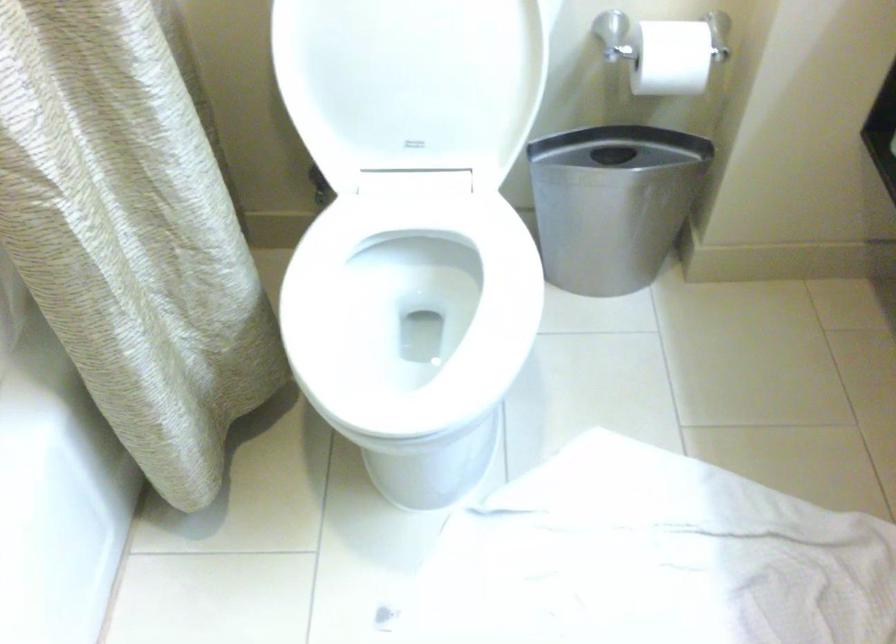
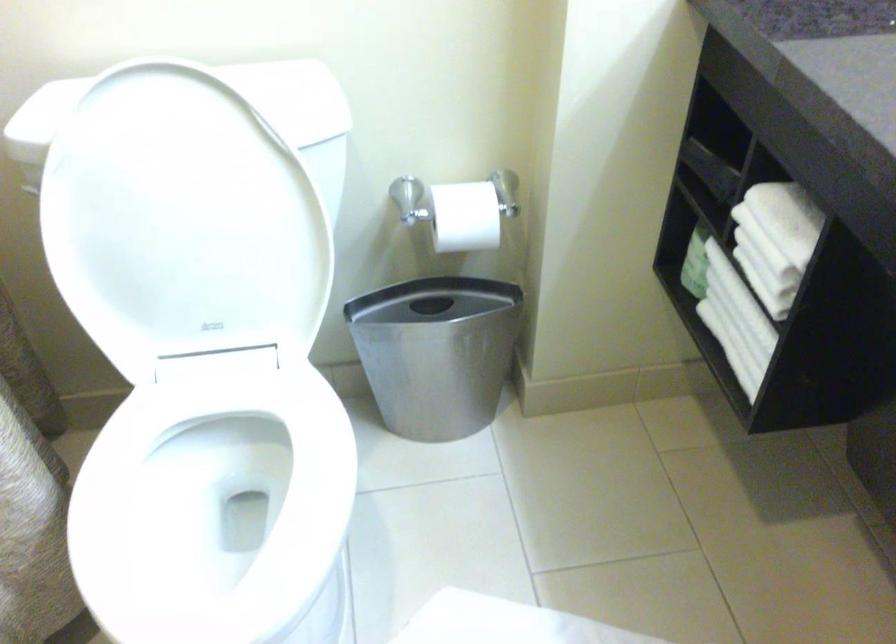
Question: The images are taken continuously from a first-person perspective. In which direction are you moving?

Choices:
 (A) Left
 (B) Right
 (C) Forward
 (D) Backward

Answer: (B)